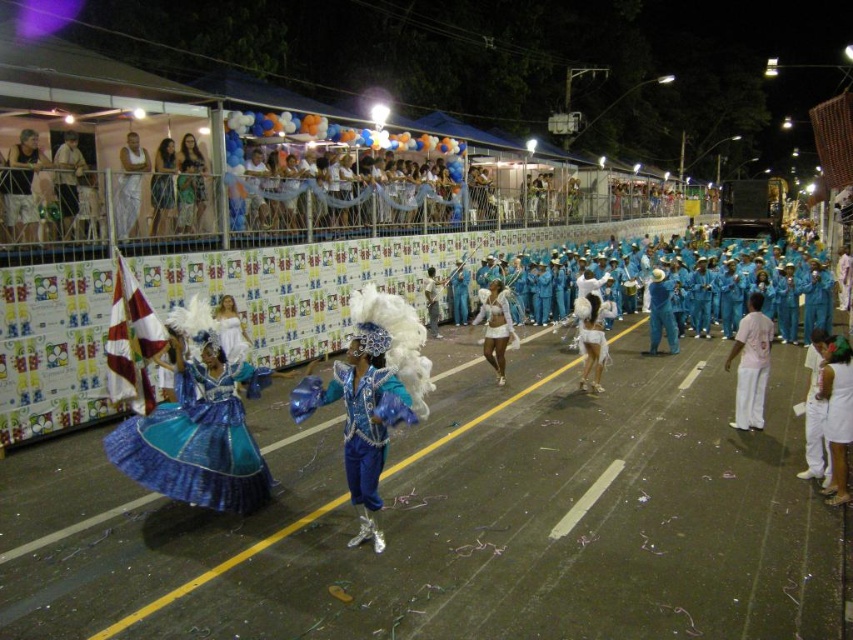
Question: In this image, where is blue satin costume at center located relative to matte black tank top at upper left?

Choices:
 (A) above
 (B) below

Answer: (B)

Question: Does blue satin costume at center have a larger size compared to matte white shirt at upper left?

Choices:
 (A) yes
 (B) no

Answer: (A)

Question: Which is farther from the matte white shirt at upper left?

Choices:
 (A) blue satin dress at center
 (B) matte black tank top at upper left

Answer: (A)

Question: Does white matte pants at right appear on the left side of white cotton dress at upper left?

Choices:
 (A) yes
 (B) no

Answer: (B)

Question: Considering the real-world distances, which object is closest to the white matte pants at right?

Choices:
 (A) white fluffy costume at center
 (B) matte black tank top at upper left
 (C) white satin dress at center
 (D) matte white shirt at upper left

Answer: (A)

Question: Estimate the real-world distances between objects in this image. Which object is closer to the white satin dress at center?

Choices:
 (A) pink fabric pants at right
 (B) blue satin costume at center
 (C) white matte pants at right

Answer: (A)